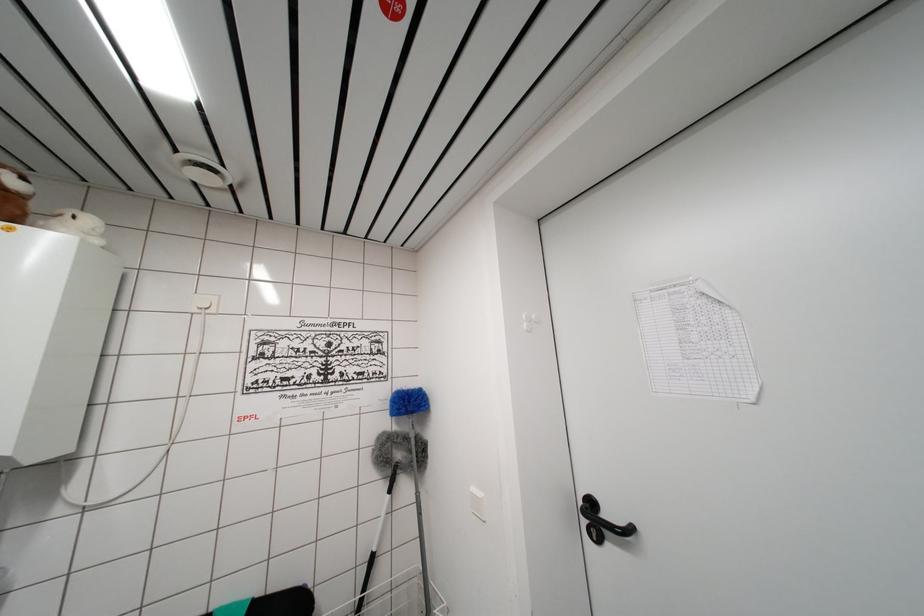
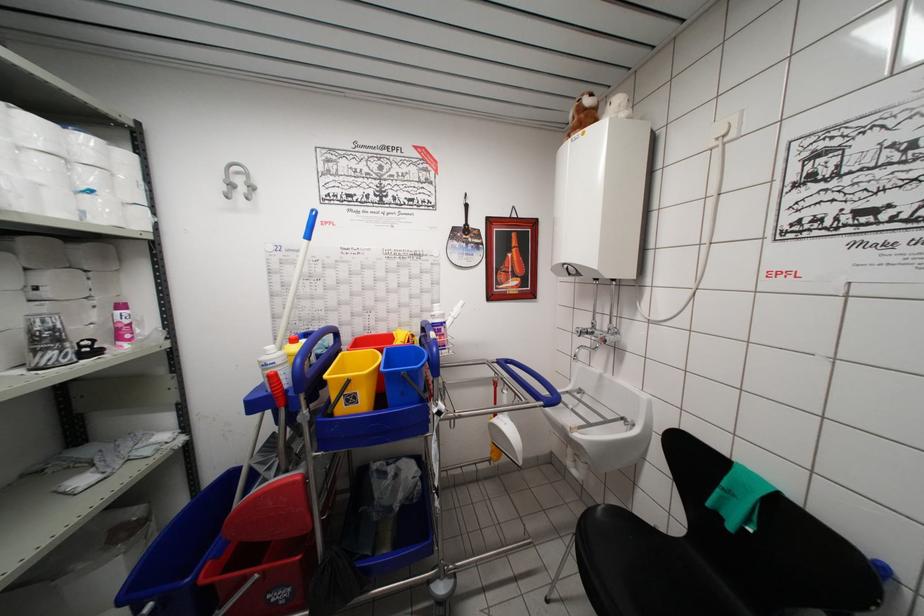
Question: The camera is either moving clockwise (left) or counter-clockwise (right) around the object. The first image is from the beginning of the video and the second image is from the end. Is the camera moving left or right when shooting the video?

Choices:
 (A) Left
 (B) Right

Answer: (B)